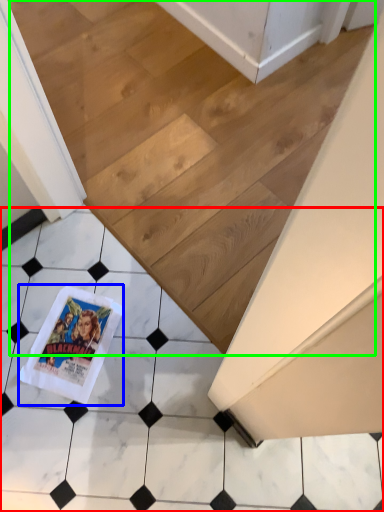
Question: Estimate the real-world distances between objects in this image. Which object is farther from tile (highlighted by a red box), comic book (highlighted by a blue box) or stairwell (highlighted by a green box)?

Choices:
 (A) comic book
 (B) stairwell

Answer: (B)